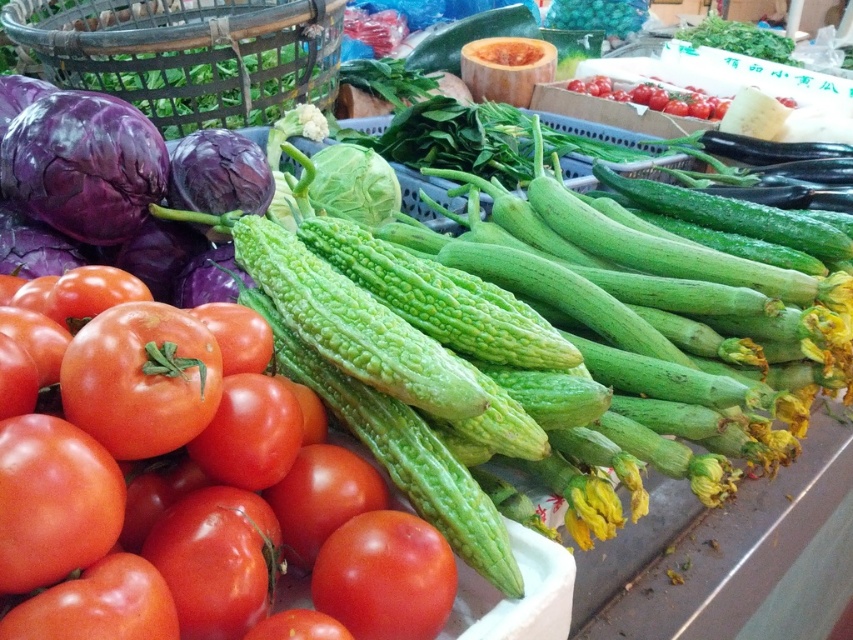
Who is lower down, red matte tomatoes at upper right or red matte tomato at lower left?

red matte tomato at lower left is lower down.

Describe the element at coordinates (653, 97) in the screenshot. The height and width of the screenshot is (640, 853). I see `red matte tomatoes at upper right` at that location.

Locate an element on the screen. This screenshot has height=640, width=853. red matte tomatoes at upper right is located at coordinates (653, 97).

Who is more forward, (115, 369) or (351, 625)?

Point (115, 369) is more forward.

Find the location of a particular element. ripe red tomato at lower left is located at coordinates (141, 378).

Is point (131, 392) positioned behind point (392, 627)?

No.

This screenshot has height=640, width=853. Identify the location of ripe red tomato at lower left. (141, 378).

Does red matte tomato at center appear on the right side of red matte tomato at lower left?

Indeed, red matte tomato at center is positioned on the right side of red matte tomato at lower left.

Is red matte tomato at center above red matte tomato at lower left?

Indeed, red matte tomato at center is positioned over red matte tomato at lower left.

Where is `red matte tomato at center`? This screenshot has width=853, height=640. red matte tomato at center is located at coordinates (386, 577).